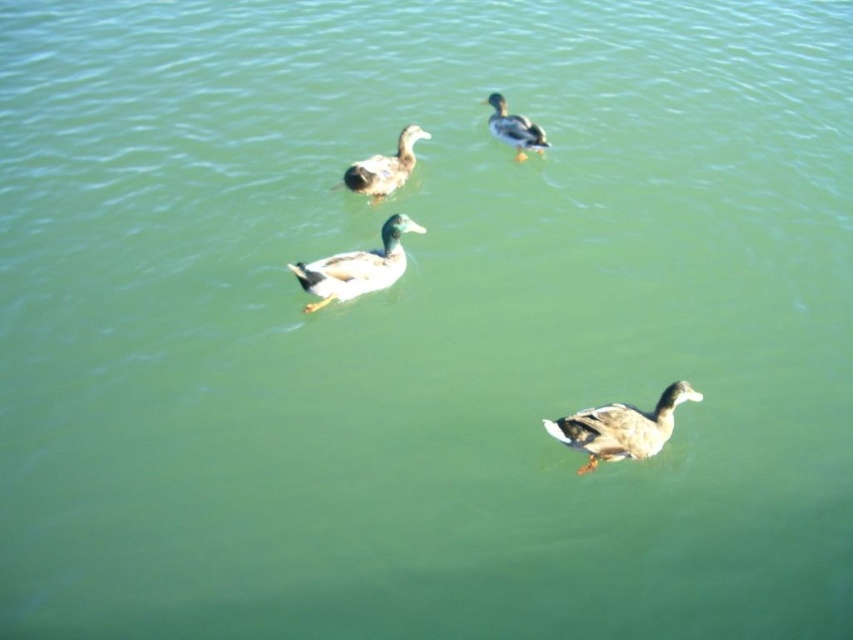
In the scene shown: Which is more to the left, brown matte duck at center or green glossy duck at upper center?

brown matte duck at center

Which of these two, brown matte duck at center or green glossy duck at upper center, stands shorter?

brown matte duck at center is shorter.

Is point (372, 196) more distant than point (534, 124)?

No, it is in front of (534, 124).

Identify the location of brown matte duck at center. This screenshot has width=853, height=640. (384, 166).

Can you confirm if green matte duck at center is positioned below green glossy duck at upper center?

Yes, green matte duck at center is below green glossy duck at upper center.

Can you confirm if green matte duck at center is taller than green glossy duck at upper center?

Yes, green matte duck at center is taller than green glossy duck at upper center.

Does point (314, 285) come behind point (508, 129)?

No, (314, 285) is in front of (508, 129).

Locate an element on the screen. green matte duck at center is located at coordinates (357, 266).

Does dark brown feathers at lower right lie behind green matte duck at center?

No.

Who is taller, dark brown feathers at lower right or green matte duck at center?

green matte duck at center

Who is more forward, (561, 426) or (316, 291)?

Positioned in front is point (561, 426).

The width and height of the screenshot is (853, 640). What are the coordinates of `dark brown feathers at lower right` in the screenshot? It's located at (621, 428).